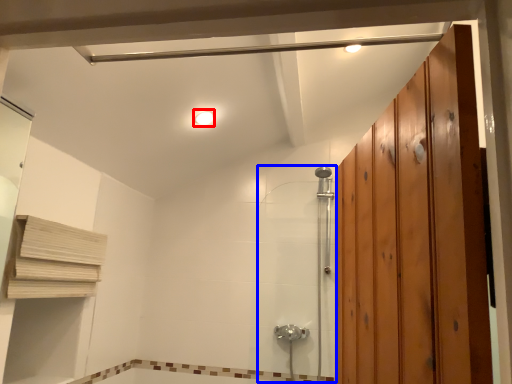
Question: Which of the following is the farthest to the observer, light fixture (highlighted by a red box) or shower door (highlighted by a blue box)?

Choices:
 (A) light fixture
 (B) shower door

Answer: (B)